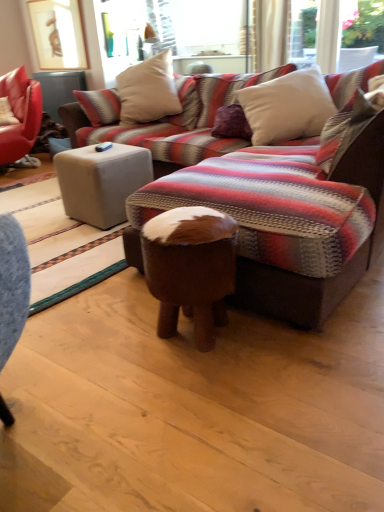
Question: Is white soft pillow at upper center, marked as the second pillow in a back-to-front arrangement, positioned in front of white soft pillow at upper right, the third pillow viewed from the back?

Choices:
 (A) yes
 (B) no

Answer: (B)

Question: Considering the relative positions of white soft pillow at upper center, the second pillow from the front, and white soft pillow at upper right, which is the 1th pillow in front-to-back order, in the image provided, is white soft pillow at upper center, the second pillow from the front, behind white soft pillow at upper right, which is the 1th pillow in front-to-back order,?

Choices:
 (A) no
 (B) yes

Answer: (B)

Question: From a real-world perspective, is white soft pillow at upper center, the second pillow from the front, on top of white soft pillow at upper right, the third pillow viewed from the back?

Choices:
 (A) yes
 (B) no

Answer: (B)

Question: Is white soft pillow at upper center, marked as the second pillow in a back-to-front arrangement, smaller than white soft pillow at upper right, which is the 1th pillow in front-to-back order?

Choices:
 (A) yes
 (B) no

Answer: (B)

Question: Would you say white soft pillow at upper center, marked as the second pillow in a back-to-front arrangement, is outside white soft pillow at upper right, which is the 1th pillow in front-to-back order?

Choices:
 (A) yes
 (B) no

Answer: (A)

Question: Is white soft pillow at upper center, marked as the second pillow in a back-to-front arrangement, facing away from white soft pillow at upper right, the third pillow viewed from the back?

Choices:
 (A) no
 (B) yes

Answer: (A)

Question: Considering the relative positions of beige fabric pillow at upper center, which is the first pillow in back-to-front order, and white soft pillow at upper right, which is the 1th pillow in front-to-back order, in the image provided, is beige fabric pillow at upper center, which is the first pillow in back-to-front order, to the right of white soft pillow at upper right, which is the 1th pillow in front-to-back order, from the viewer's perspective?

Choices:
 (A) no
 (B) yes

Answer: (A)

Question: Is beige fabric pillow at upper center, which is the first pillow in back-to-front order, placed right next to white soft pillow at upper right, the third pillow viewed from the back?

Choices:
 (A) no
 (B) yes

Answer: (A)

Question: Is beige fabric pillow at upper center, which is the first pillow in back-to-front order, facing towards white soft pillow at upper right, the third pillow viewed from the back?

Choices:
 (A) no
 (B) yes

Answer: (A)

Question: Considering the relative positions of beige fabric pillow at upper center, which is the first pillow in back-to-front order, and white soft pillow at upper right, which is the 1th pillow in front-to-back order, in the image provided, is beige fabric pillow at upper center, which is the first pillow in back-to-front order, to the left of white soft pillow at upper right, which is the 1th pillow in front-to-back order, from the viewer's perspective?

Choices:
 (A) yes
 (B) no

Answer: (A)

Question: Considering the relative sizes of beige fabric pillow at upper center, which is the 3th pillow in front-to-back order, and white soft pillow at upper right, the third pillow viewed from the back, in the image provided, is beige fabric pillow at upper center, which is the 3th pillow in front-to-back order, thinner than white soft pillow at upper right, the third pillow viewed from the back,?

Choices:
 (A) no
 (B) yes

Answer: (A)

Question: Does beige fabric pillow at upper center, which is the 3th pillow in front-to-back order, have a greater height compared to white soft pillow at upper right, which is the 1th pillow in front-to-back order?

Choices:
 (A) yes
 (B) no

Answer: (A)

Question: Considering the relative positions of beige fabric pillow at upper center, which is the 3th pillow in front-to-back order, and white soft pillow at upper center, marked as the second pillow in a back-to-front arrangement, in the image provided, is beige fabric pillow at upper center, which is the 3th pillow in front-to-back order, to the right of white soft pillow at upper center, marked as the second pillow in a back-to-front arrangement, from the viewer's perspective?

Choices:
 (A) yes
 (B) no

Answer: (B)